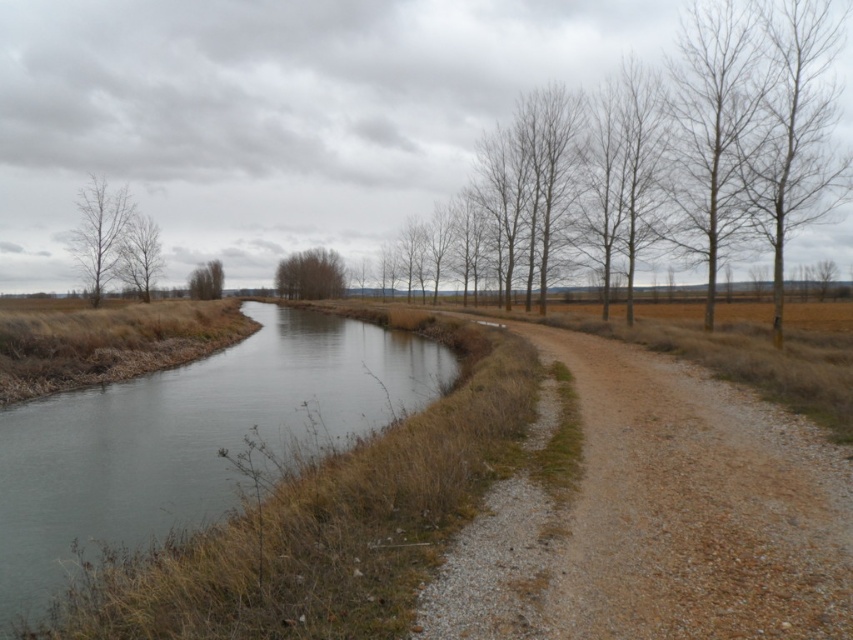
Can you confirm if brown textured tree at center is bigger than bare wood tree at left?

Yes, brown textured tree at center is bigger than bare wood tree at left.

Does brown textured tree at center have a lesser width compared to bare wood tree at left?

No.

Is point (305, 298) closer to camera compared to point (132, 282)?

That is False.

Where is `brown textured tree at center`? This screenshot has width=853, height=640. brown textured tree at center is located at coordinates (310, 275).

Can you confirm if bare wood tree at left is positioned to the left of green leafy tree at upper center?

Incorrect, bare wood tree at left is not on the left side of green leafy tree at upper center.

Who is positioned more to the right, bare wood tree at left or green leafy tree at upper center?

bare wood tree at left is more to the right.

Between point (117, 252) and point (206, 296), which one is positioned in front?

Point (117, 252) is in front.

Where is `bare wood tree at left`? This screenshot has width=853, height=640. bare wood tree at left is located at coordinates (138, 253).

Is point (80, 266) less distant than point (190, 296)?

Yes, point (80, 266) is in front of point (190, 296).

Can you confirm if bare branches at left is taller than green leafy tree at upper center?

Yes.

Which is behind, point (120, 248) or point (212, 288)?

Positioned behind is point (212, 288).

The height and width of the screenshot is (640, 853). I want to click on bare branches at left, so click(x=99, y=234).